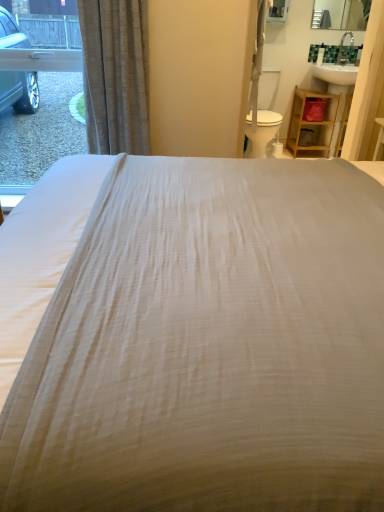
Question: Considering the relative sizes of wooden shelf at right and white plastic swivel chair at center-right in the image provided, is wooden shelf at right taller than white plastic swivel chair at center-right?

Choices:
 (A) no
 (B) yes

Answer: (A)

Question: Is wooden shelf at right far from white plastic swivel chair at center-right?

Choices:
 (A) no
 (B) yes

Answer: (A)

Question: From the image's perspective, would you say wooden shelf at right is positioned over white plastic swivel chair at center-right?

Choices:
 (A) yes
 (B) no

Answer: (B)

Question: Does wooden shelf at right have a greater width compared to white plastic swivel chair at center-right?

Choices:
 (A) yes
 (B) no

Answer: (B)

Question: Does wooden shelf at right have a larger size compared to white plastic swivel chair at center-right?

Choices:
 (A) yes
 (B) no

Answer: (B)

Question: Which is correct: white plastic swivel chair at center-right is inside white textured bed at center, or outside of it?

Choices:
 (A) outside
 (B) inside

Answer: (A)

Question: Considering the positions of white plastic swivel chair at center-right and white textured bed at center in the image, is white plastic swivel chair at center-right bigger or smaller than white textured bed at center?

Choices:
 (A) small
 (B) big

Answer: (A)

Question: In the image, is white plastic swivel chair at center-right on the left side or the right side of white textured bed at center?

Choices:
 (A) left
 (B) right

Answer: (B)

Question: From a real-world perspective, relative to white textured bed at center, is white plastic swivel chair at center-right vertically above or below?

Choices:
 (A) above
 (B) below

Answer: (B)

Question: Is white plastic swivel chair at center-right wider or thinner than wooden shelf at right?

Choices:
 (A) thin
 (B) wide

Answer: (B)

Question: From the image's perspective, is white plastic swivel chair at center-right above or below wooden shelf at right?

Choices:
 (A) above
 (B) below

Answer: (A)

Question: Considering the positions of white plastic swivel chair at center-right and wooden shelf at right in the image, is white plastic swivel chair at center-right taller or shorter than wooden shelf at right?

Choices:
 (A) short
 (B) tall

Answer: (B)

Question: Is point (271, 133) closer or farther from the camera than point (297, 121)?

Choices:
 (A) farther
 (B) closer

Answer: (B)

Question: In terms of width, does clear glass window at left look wider or thinner when compared to white textured bed at center?

Choices:
 (A) wide
 (B) thin

Answer: (B)

Question: From a real-world perspective, relative to white textured bed at center, is clear glass window at left vertically above or below?

Choices:
 (A) above
 (B) below

Answer: (A)